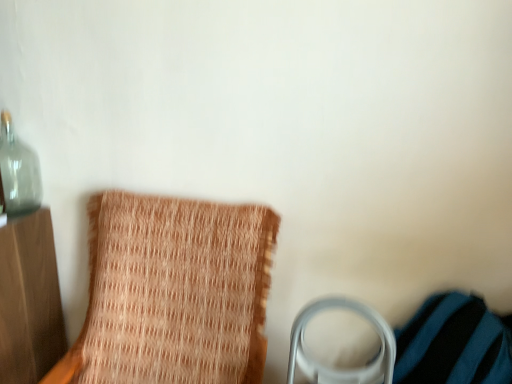
Question: Is transparent glass bottle at upper left taller than woven fabric chair at left?

Choices:
 (A) yes
 (B) no

Answer: (B)

Question: Does transparent glass bottle at upper left have a greater width compared to woven fabric chair at left?

Choices:
 (A) no
 (B) yes

Answer: (A)

Question: From the image's perspective, does transparent glass bottle at upper left appear higher than woven fabric chair at left?

Choices:
 (A) yes
 (B) no

Answer: (A)

Question: Can you confirm if transparent glass bottle at upper left is smaller than woven fabric chair at left?

Choices:
 (A) no
 (B) yes

Answer: (B)

Question: Can you confirm if transparent glass bottle at upper left is positioned to the right of woven fabric chair at left?

Choices:
 (A) yes
 (B) no

Answer: (B)

Question: Is transparent glass bottle at upper left shorter than woven fabric chair at left?

Choices:
 (A) yes
 (B) no

Answer: (A)

Question: Can you confirm if woven fabric chair at left is positioned to the left of transparent glass bottle at upper left?

Choices:
 (A) no
 (B) yes

Answer: (A)

Question: Does woven fabric chair at left come in front of transparent glass bottle at upper left?

Choices:
 (A) no
 (B) yes

Answer: (B)

Question: From a real-world perspective, is woven fabric chair at left below transparent glass bottle at upper left?

Choices:
 (A) yes
 (B) no

Answer: (A)

Question: Would you say woven fabric chair at left contains transparent glass bottle at upper left?

Choices:
 (A) no
 (B) yes

Answer: (A)

Question: Does woven fabric chair at left have a larger size compared to transparent glass bottle at upper left?

Choices:
 (A) yes
 (B) no

Answer: (A)

Question: Considering the relative sizes of woven fabric chair at left and transparent glass bottle at upper left in the image provided, is woven fabric chair at left wider than transparent glass bottle at upper left?

Choices:
 (A) yes
 (B) no

Answer: (A)

Question: In terms of width, does transparent glass bottle at upper left look wider or thinner when compared to woven fabric chair at left?

Choices:
 (A) thin
 (B) wide

Answer: (A)